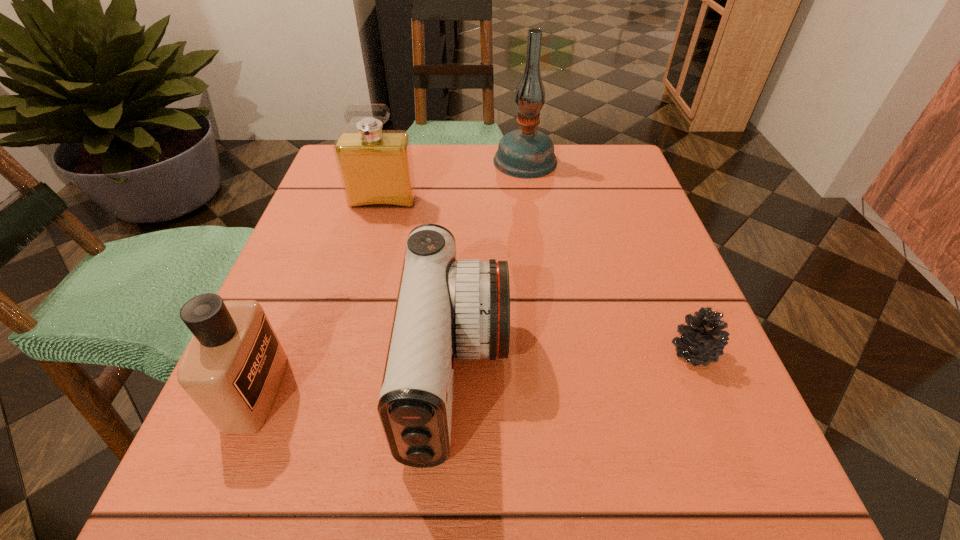
You are a GUI agent. You are given a task and a screenshot of the screen. Output one action in this format:
    pyautogui.click(x=<x>, y=<y>)
    Task: Click on the oil lamp
    The height and width of the screenshot is (540, 960).
    Given the screenshot: What is the action you would take?
    pyautogui.click(x=526, y=153)

This screenshot has width=960, height=540. Find the location of `the tallest object`. the tallest object is located at coordinates (526, 153).

Where is `the farther perfume`? The width and height of the screenshot is (960, 540). the farther perfume is located at coordinates (376, 168).

Find the location of a particular element. the right perfume is located at coordinates (376, 168).

Where is `camcorder`? camcorder is located at coordinates (445, 309).

You are a GUI agent. You are given a task and a screenshot of the screen. Output one action in this format:
    pyautogui.click(x=<x>, y=<y>)
    Task: Click on the nearer perfume
    
    Given the screenshot: What is the action you would take?
    pyautogui.click(x=232, y=368)

The image size is (960, 540). Identify the location of the shorter perfume. (232, 368).

Where is `the shortest object`? This screenshot has height=540, width=960. the shortest object is located at coordinates (702, 340).

The width and height of the screenshot is (960, 540). Find the location of `pinecone`. pinecone is located at coordinates (702, 340).

Where is `blank space located 0.170m on the left of the oil lamp`? The height and width of the screenshot is (540, 960). blank space located 0.170m on the left of the oil lamp is located at coordinates (422, 160).